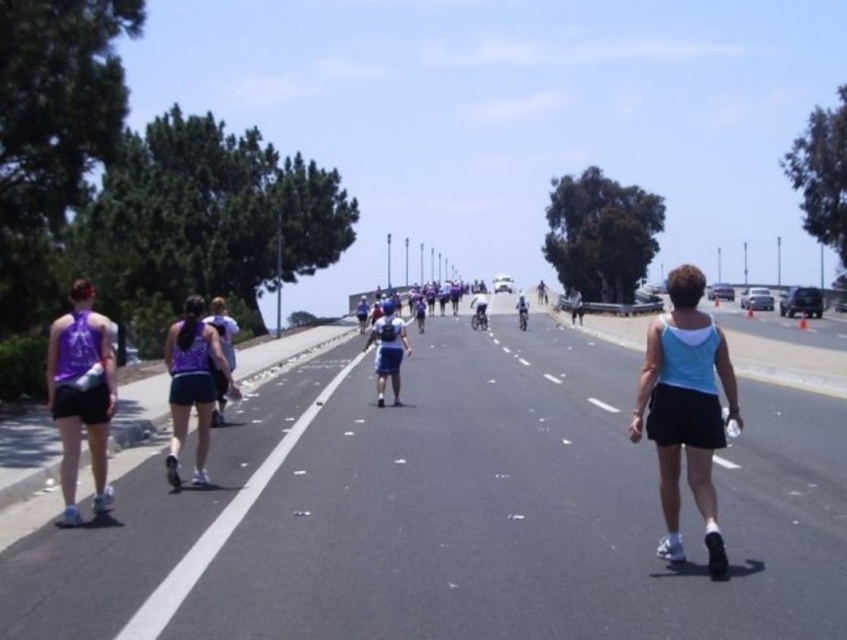
You are a photographer standing at the starting line of the marathon, and you want to capture a closeup shot of the purple fabric tank top at left. Considering your camera can focus on objects within 5 meters, will you be able to take the photo?

The purple fabric tank top at left is 7.31 meters away from camera, which is beyond the camera focus range of 5 meters. Therefore, you cannot take a closeup shot.

You are a photographer positioned at the starting line of the marathon. You want to capture a photo that includes both the purple fabric tank top at left and the shiny silver bicycle at center. Which object should you focus on first to ensure both are in the frame?

The purple fabric tank top at left is closer to the viewer than the shiny silver bicycle at center, so you should focus on the purple fabric tank top at left first to ensure both are in focus and properly framed.

You are a participant in the marathon and you see the point marked at coordinates (81, 394). What object is located at that point?

The point at coordinates (81, 394) corresponds to the purple fabric tank top at left.